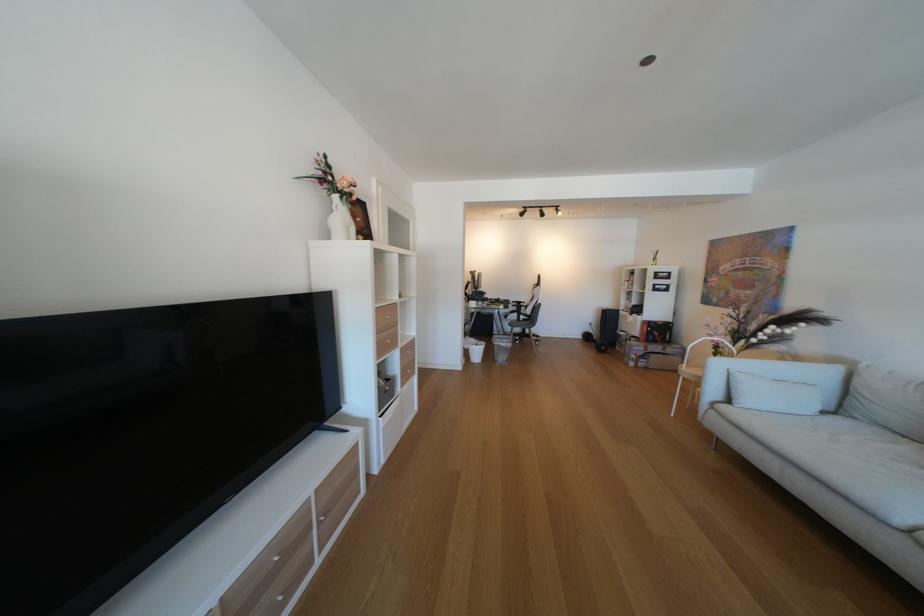
The width and height of the screenshot is (924, 616). What are the coordinates of `white box handle` in the screenshot? It's located at (390, 318).